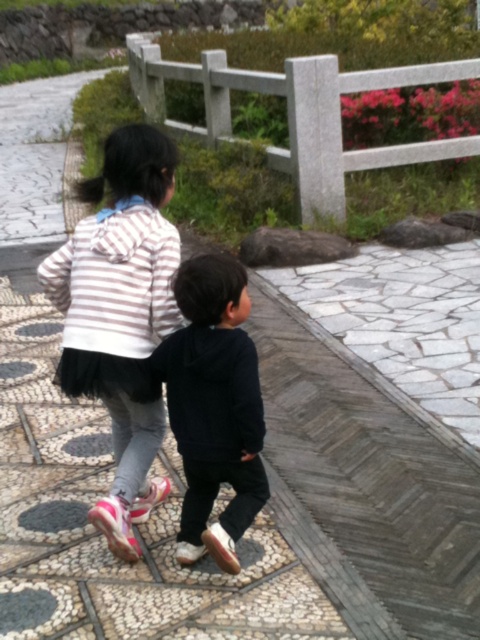
Who is more forward, (51,269) or (160,348)?

Point (160,348) is more forward.

Is striped hoodie at center positioned behind dark blue hoodie at center?

Yes, it is behind dark blue hoodie at center.

Is point (69, 324) positioned behind point (189, 346)?

Yes, point (69, 324) is behind point (189, 346).

This screenshot has height=640, width=480. Identify the location of striped hoodie at center. (120, 316).